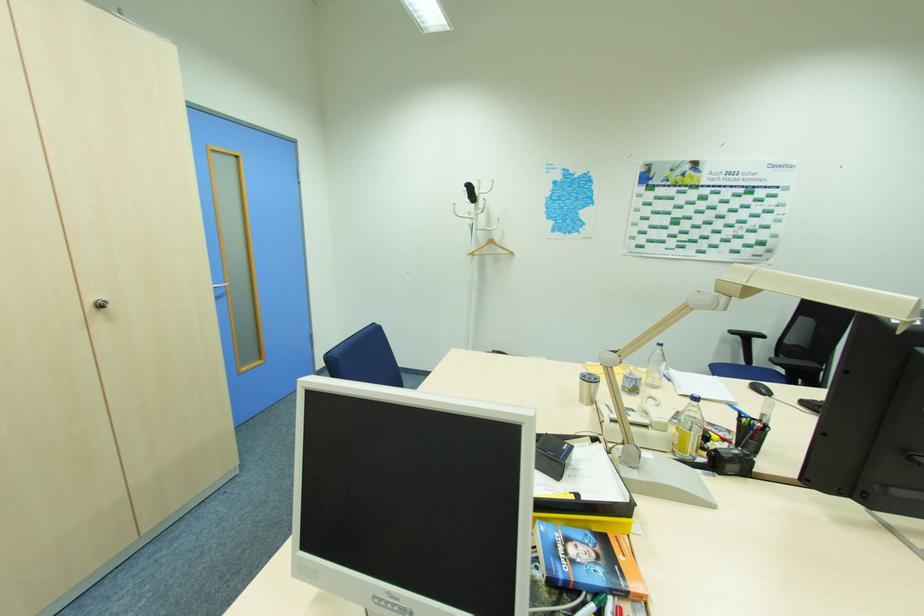
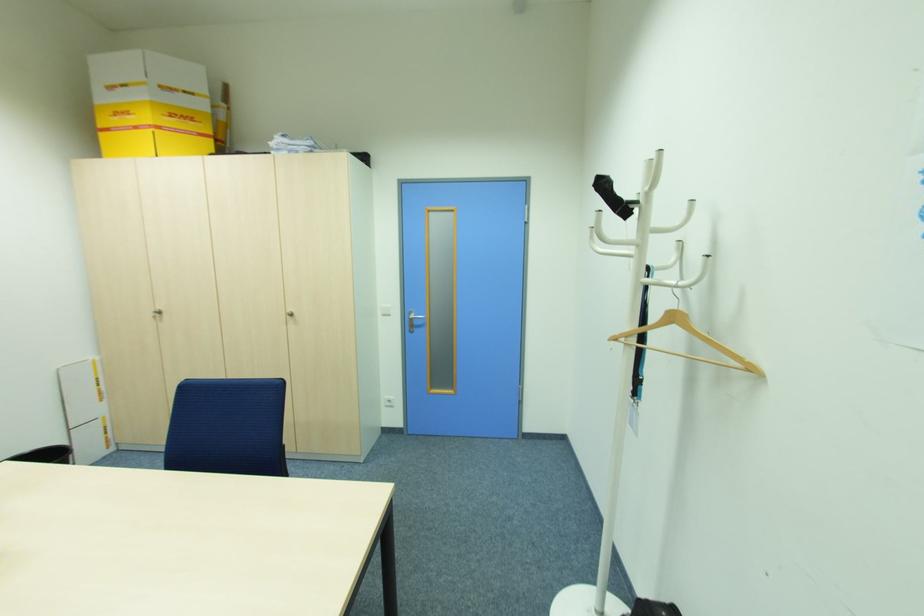
Find the pixel in the second image that matches point (515, 254) in the first image.

(756, 370)